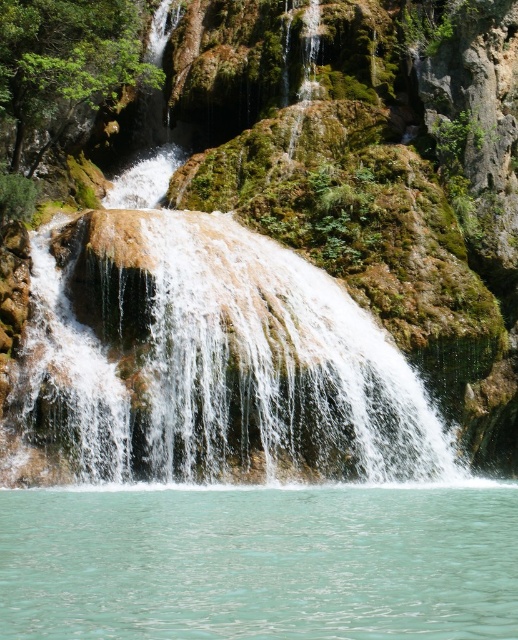
Question: Can you confirm if green mossy rock at center is thinner than turquoise liquid at bottom?

Choices:
 (A) yes
 (B) no

Answer: (B)

Question: Does green mossy rock at center appear on the right side of turquoise liquid at bottom?

Choices:
 (A) yes
 (B) no

Answer: (B)

Question: Is green mossy rock at center smaller than turquoise liquid at bottom?

Choices:
 (A) no
 (B) yes

Answer: (A)

Question: Which point is farther to the camera?

Choices:
 (A) (269, 630)
 (B) (294, 346)

Answer: (B)